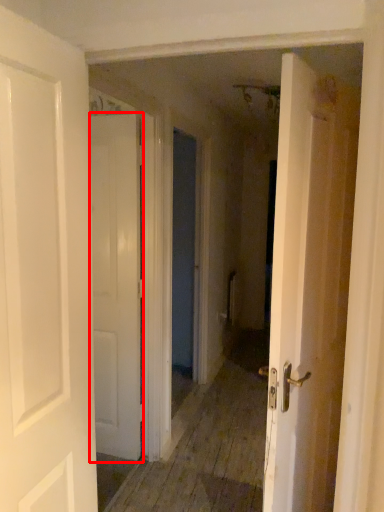
Question: In this image, where is door (annotated by the red box) located relative to door?

Choices:
 (A) right
 (B) left

Answer: (A)